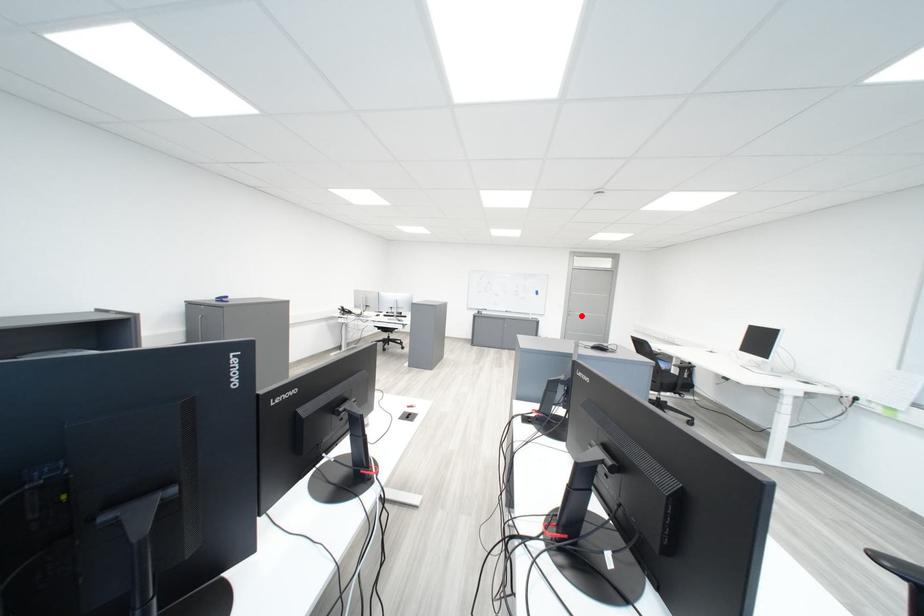
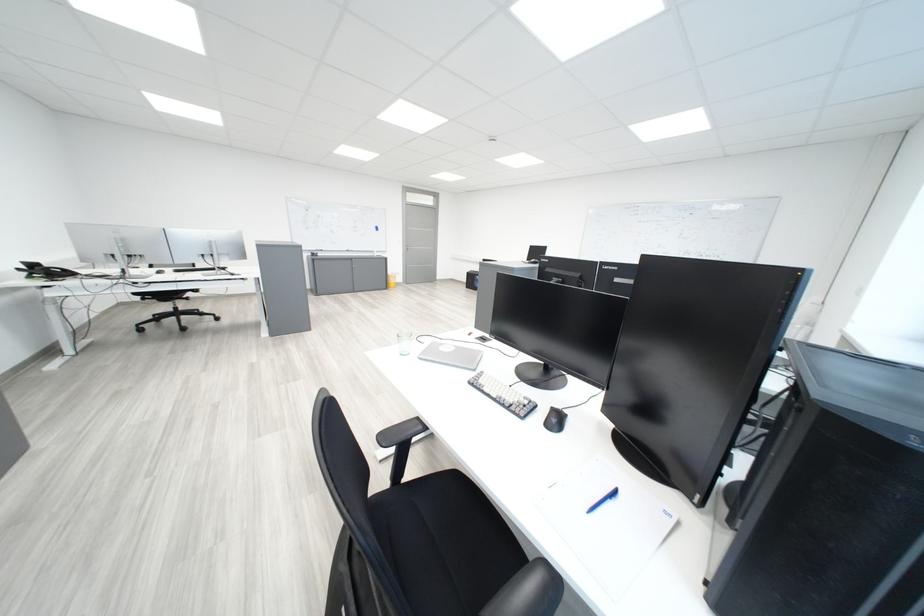
Question: I am providing you with two images of the same scene from different viewpoints. Image1 has a red point marked. In image2, the corresponding 3D location appears at what relative position? Reply with the corresponding letter.

Choices:
 (A) Closer
 (B) Farther

Answer: (A)